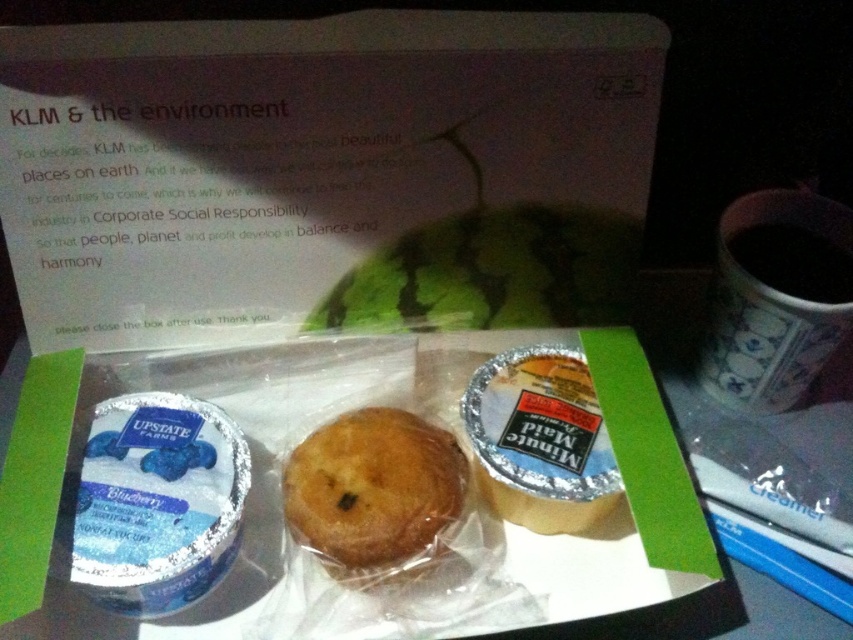
Can you confirm if white ceramic mug at upper right is positioned above black matte cup at right?

Incorrect, white ceramic mug at upper right is not positioned above black matte cup at right.

Between point (798, 273) and point (796, 294), which one is positioned in front?

Point (796, 294)

Who is more distant from viewer, (810, 339) or (752, 273)?

The point (752, 273) is more distant.

Image resolution: width=853 pixels, height=640 pixels. I want to click on white ceramic mug at upper right, so click(776, 298).

Between golden brown muffin at center and black matte cup at right, which one has less height?

black matte cup at right

Does golden brown muffin at center appear on the left side of black matte cup at right?

Correct, you'll find golden brown muffin at center to the left of black matte cup at right.

Is point (341, 560) closer to viewer compared to point (796, 232)?

That is True.

You are a GUI agent. You are given a task and a screenshot of the screen. Output one action in this format:
    pyautogui.click(x=<x>, y=<y>)
    Task: Click on the golden brown muffin at center
    
    Given the screenshot: What is the action you would take?
    pos(372,488)

Which is more to the right, white ceramic mug at upper right or golden brown muffin at center?

From the viewer's perspective, white ceramic mug at upper right appears more on the right side.

What do you see at coordinates (776, 298) in the screenshot?
I see `white ceramic mug at upper right` at bounding box center [776, 298].

Find the location of a particular element. The height and width of the screenshot is (640, 853). white ceramic mug at upper right is located at coordinates click(x=776, y=298).